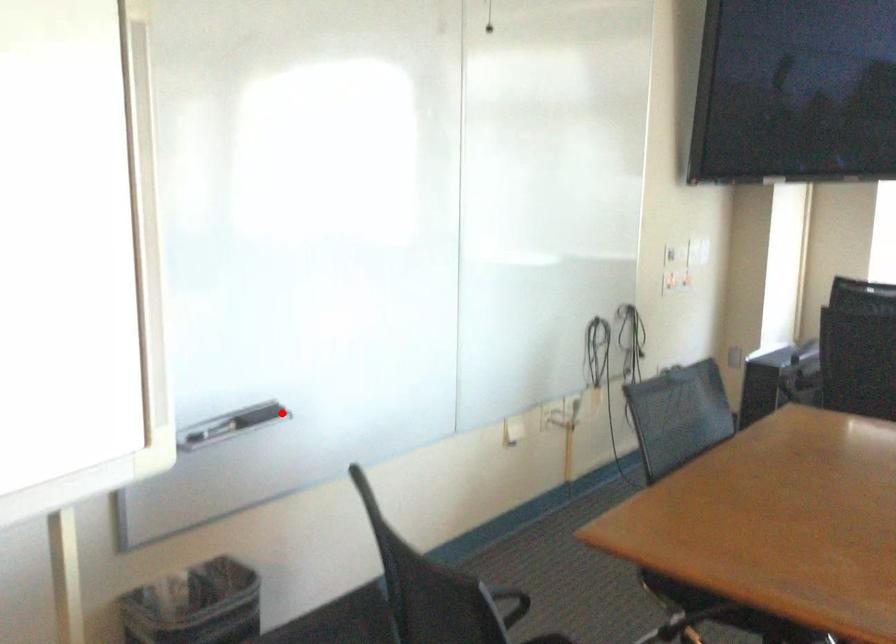
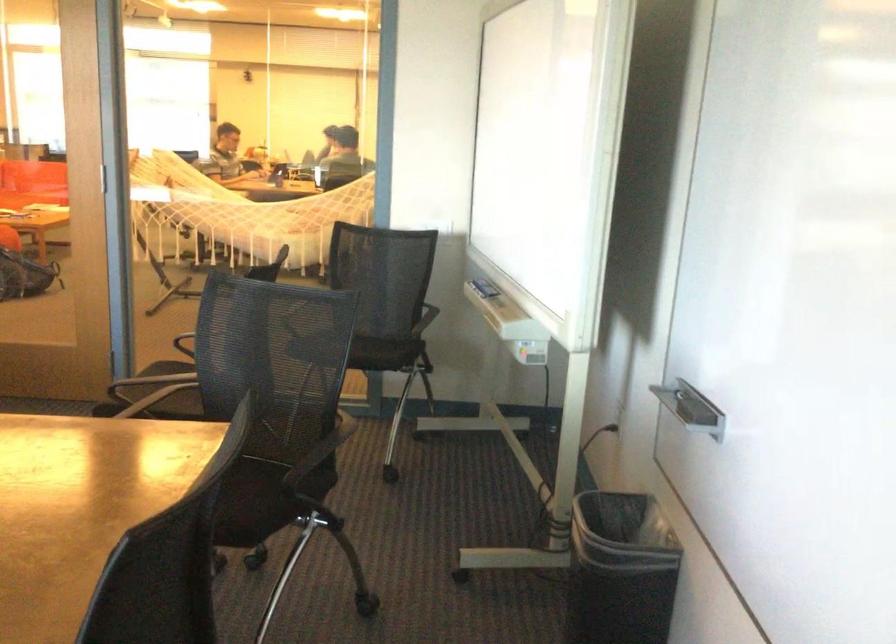
Question: I am providing you with two images of the same scene from different viewpoints. A red point is shown in image1. For the corresponding object point in image2, is it positioned nearer or farther from the camera?

Choices:
 (A) Nearer
 (B) Farther

Answer: (A)